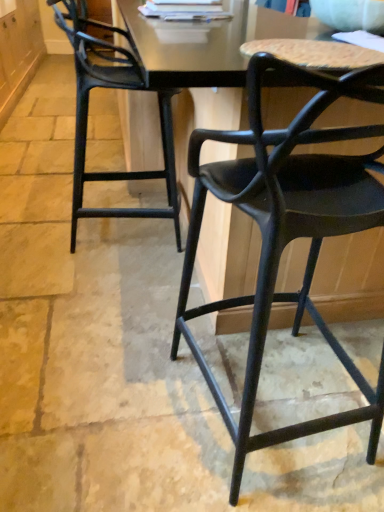
Question: Is matte black chair at center, marked as the first chair in a front-to-back arrangement, inside or outside of matte black chair at left, arranged as the second chair when viewed from the right?

Choices:
 (A) inside
 (B) outside

Answer: (B)

Question: In terms of height, does matte black chair at center, the 2th chair in the left-to-right sequence, look taller or shorter compared to matte black chair at left, acting as the first chair starting from the left?

Choices:
 (A) tall
 (B) short

Answer: (A)

Question: In terms of width, does matte black chair at center, which is counted as the second chair, starting from the back, look wider or thinner when compared to matte black chair at left, arranged as the second chair when viewed from the right?

Choices:
 (A) wide
 (B) thin

Answer: (A)

Question: From a real-world perspective, relative to matte black chair at center, marked as the first chair in a front-to-back arrangement, is matte black chair at left, the 2th chair positioned from the front, vertically above or below?

Choices:
 (A) above
 (B) below

Answer: (B)

Question: Is matte black chair at left, acting as the first chair starting from the left, situated inside matte black chair at center, which is counted as the second chair, starting from the back, or outside?

Choices:
 (A) inside
 (B) outside

Answer: (B)

Question: Is point (84, 41) positioned closer to the camera than point (299, 137)?

Choices:
 (A) farther
 (B) closer

Answer: (A)

Question: From the image's perspective, relative to matte black chair at center, marked as the first chair in a front-to-back arrangement, is matte black chair at left, acting as the first chair starting from the left, above or below?

Choices:
 (A) above
 (B) below

Answer: (A)